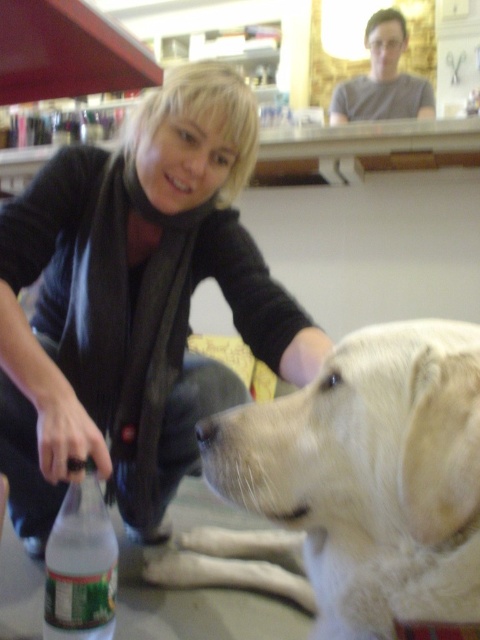
Image resolution: width=480 pixels, height=640 pixels. Describe the element at coordinates (355, 484) in the screenshot. I see `white fur dog at lower center` at that location.

Does white fur dog at lower center have a smaller size compared to green plastic bottle at lower left?

Actually, white fur dog at lower center might be larger than green plastic bottle at lower left.

Describe the element at coordinates (355, 484) in the screenshot. I see `white fur dog at lower center` at that location.

At what (x,y) coordinates should I click in order to perform the action: click on white fur dog at lower center. Please return your answer as a coordinate pair (x, y). Looking at the image, I should click on (355, 484).

Who is higher up, black sweater at center or white fur dog at lower center?

black sweater at center is higher up.

Who is positioned more to the left, black sweater at center or white fur dog at lower center?

black sweater at center is more to the left.

Identify the location of black sweater at center. (133, 304).

Identify the location of black sweater at center. [x=133, y=304].

Who is positioned more to the right, black sweater at center or green plastic bottle at lower left?

black sweater at center is more to the right.

Is black sweater at center to the left of green plastic bottle at lower left from the viewer's perspective?

No, black sweater at center is not to the left of green plastic bottle at lower left.

Is point (70, 428) closer to camera compared to point (93, 518)?

That is True.

At what (x,y) coordinates should I click in order to perform the action: click on black sweater at center. Please return your answer as a coordinate pair (x, y). Looking at the image, I should click on (133, 304).